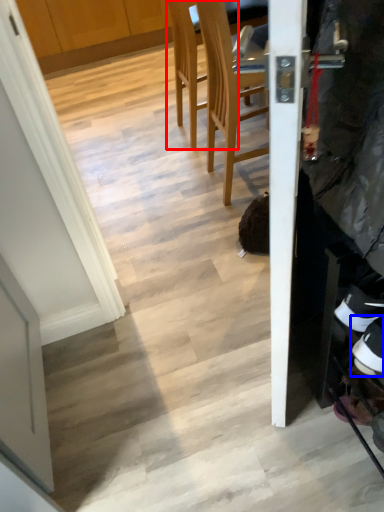
Question: Which of the following is the closest to the observer, chair (highlighted by a red box) or footwear (highlighted by a blue box)?

Choices:
 (A) chair
 (B) footwear

Answer: (B)